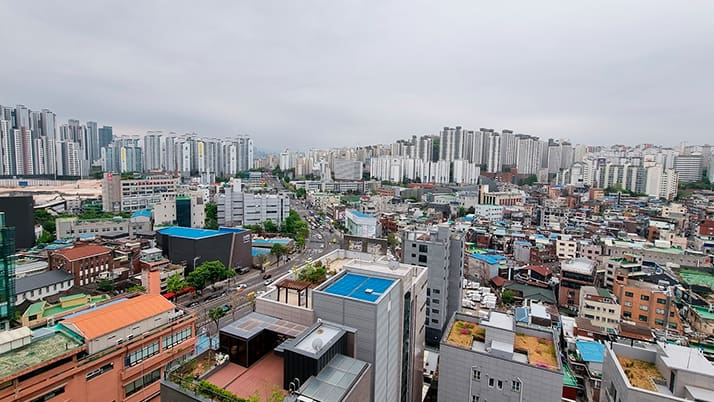
Where is `window`? The image size is (714, 402). window is located at coordinates (493, 384).